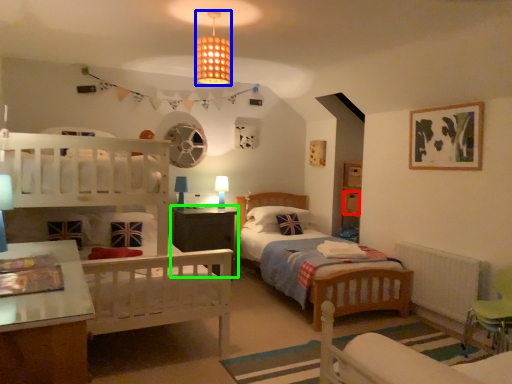
Question: Which object is the closest to the drawer (highlighted by a red box)? Choose among these: lighting (highlighted by a blue box) or nightstand (highlighted by a green box).

Choices:
 (A) lighting
 (B) nightstand

Answer: (B)